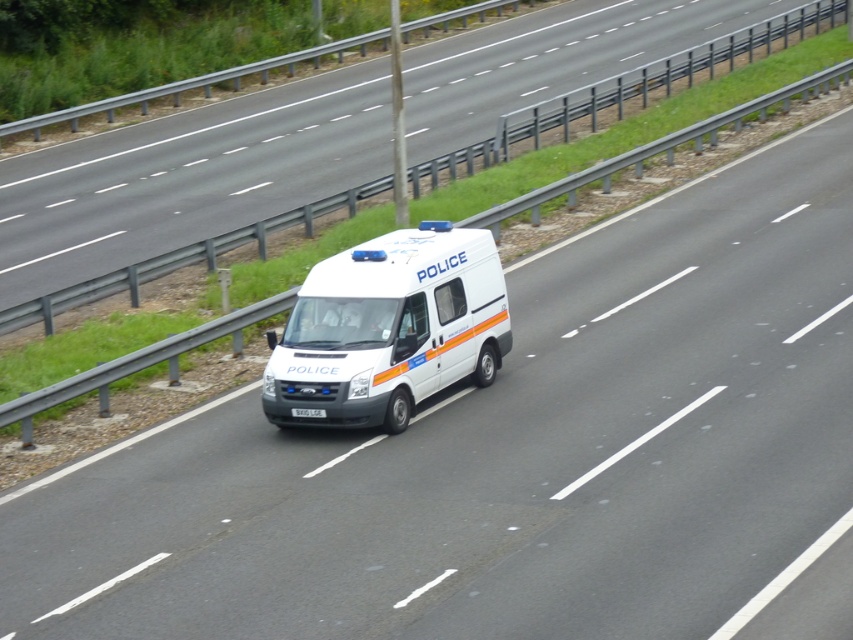
Looking at this image, you are a traffic officer who needs to verify the license plate number of the white matte van at center. However, you notice that the license plate is white plastic license plate at center. Can you determine if the license plate is attached to the correct vehicle based on their sizes?

The white matte van at center is taller than white plastic license plate at center, so the license plate is likely attached to the correct vehicle since it is smaller and positioned on the van.

You are a traffic officer observing a white glossy van at center and a white plastic license plate at center on the highway. Which object is closer to the right side of the road?

The white glossy van at center is to the right of the white plastic license plate at center, so the white glossy van at center is closer to the right side of the road.

Consider the image. You are a driver approaching the white matte van at center and the white plastic license plate at center on the highway. Which object will you see first as you drive towards them?

The white matte van at center will be seen first because it is closer to the viewer than the white plastic license plate at center.